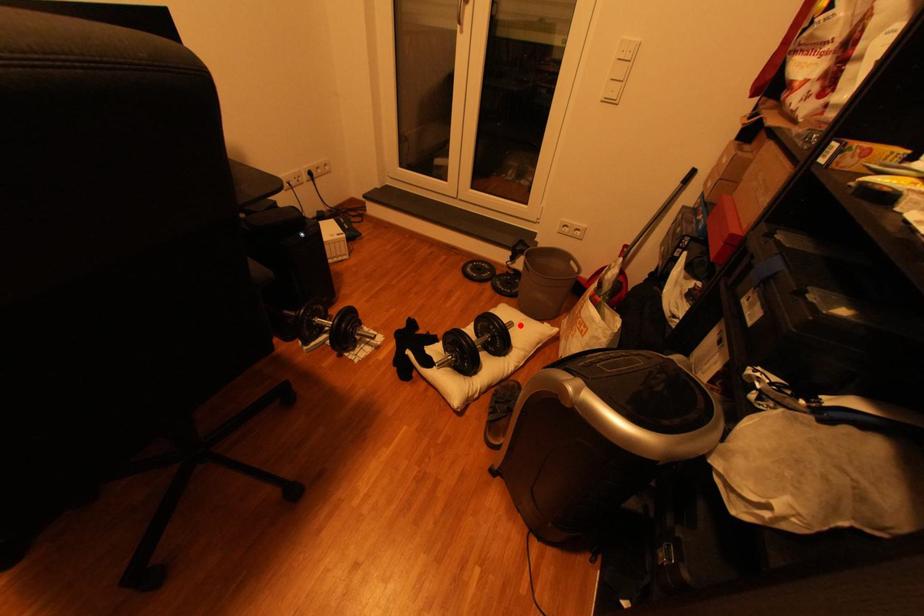
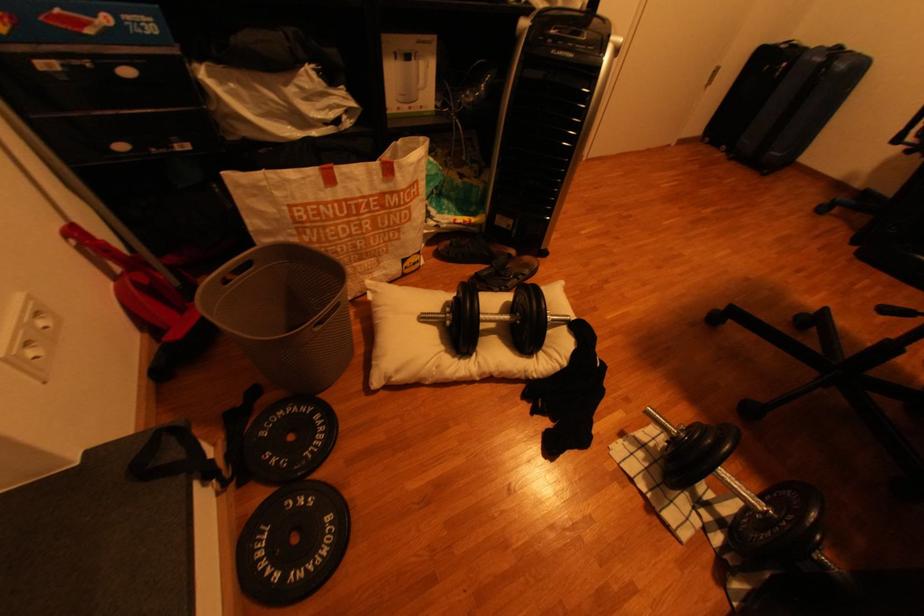
Question: I am providing you with two images of the same scene from different viewpoints. Given a red point in image1, look at the same physical point in image2. Is it:

Choices:
 (A) Closer to the viewpoint
 (B) Farther from the viewpoint

Answer: (A)